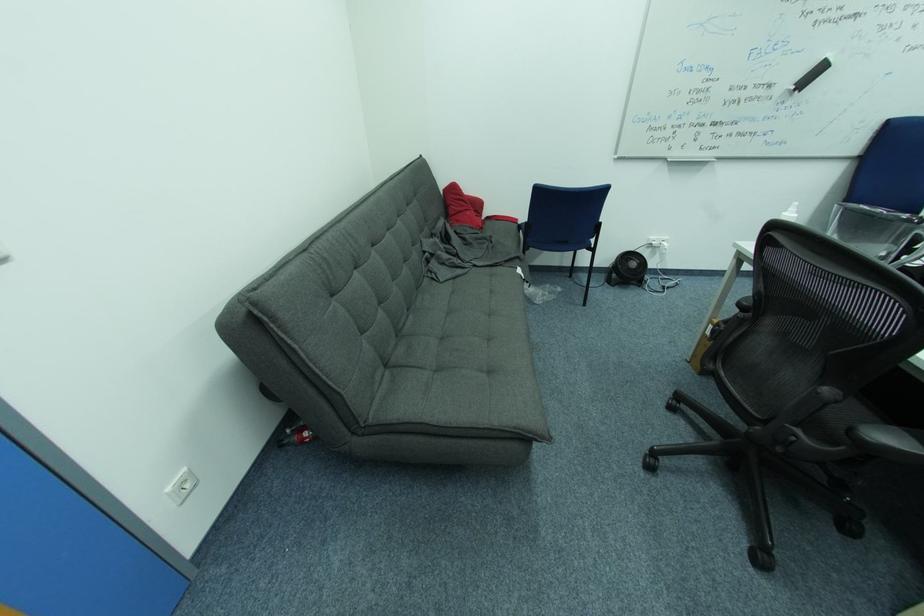
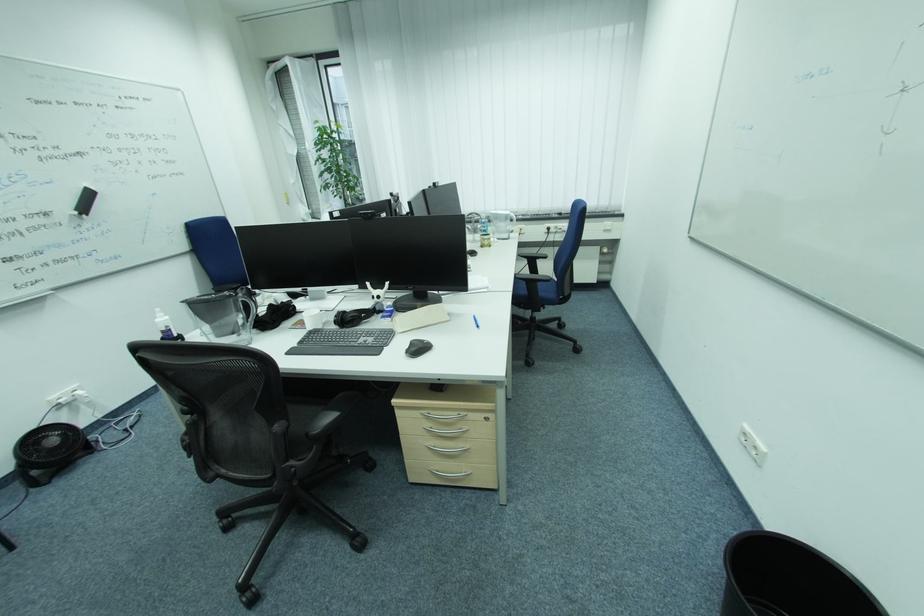
The point at (639, 265) is marked in the first image. Where is the corresponding point in the second image?

(59, 442)